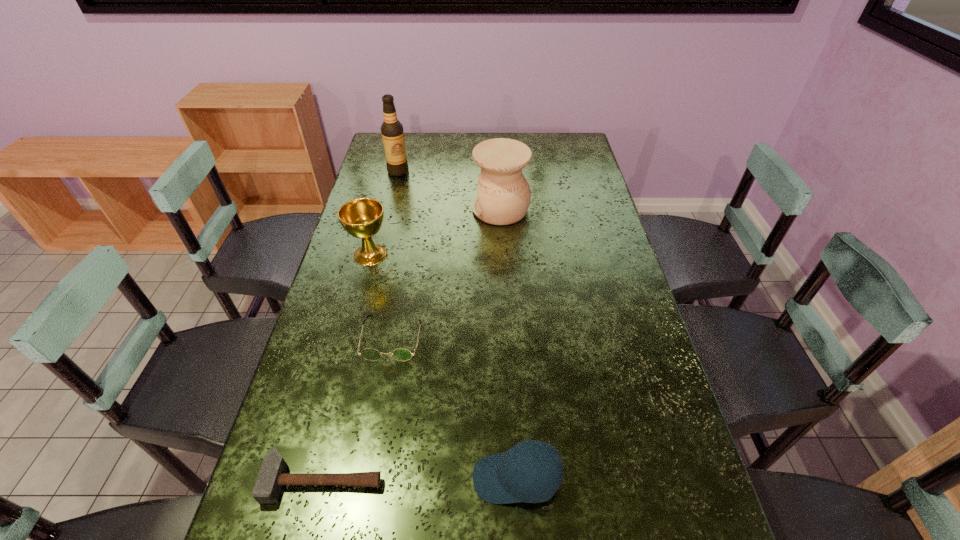
Find the location of a particular element. alcohol is located at coordinates (392, 132).

Identify the location of the farthest object. This screenshot has height=540, width=960. (392, 132).

Find the location of a particular element. The width and height of the screenshot is (960, 540). pottery is located at coordinates (504, 195).

Image resolution: width=960 pixels, height=540 pixels. In order to click on the fifth nearest object in this screenshot , I will do `click(504, 195)`.

Image resolution: width=960 pixels, height=540 pixels. Identify the location of chalice. (362, 218).

This screenshot has width=960, height=540. Find the location of `the third tallest object`. the third tallest object is located at coordinates (362, 218).

In order to click on the third shortest object in this screenshot , I will do `click(496, 481)`.

Locate an element on the screen. This screenshot has width=960, height=540. spectacles is located at coordinates (400, 354).

You are a GUI agent. You are given a task and a screenshot of the screen. Output one action in this format:
    pyautogui.click(x=<x>, y=<y>)
    Task: Click on the fourth farthest object
    The height and width of the screenshot is (540, 960).
    Given the screenshot: What is the action you would take?
    pyautogui.click(x=400, y=354)

You are a GUI agent. You are given a task and a screenshot of the screen. Output one action in this format:
    pyautogui.click(x=<x>, y=<y>)
    Task: Click on the hammer
    The image size is (960, 540).
    Given the screenshot: What is the action you would take?
    pyautogui.click(x=272, y=475)